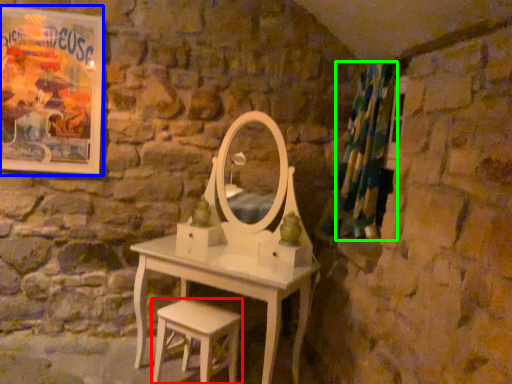
Question: Considering the real-world distances, which object is farthest from stool (highlighted by a red box)? poster page (highlighted by a blue box) or shower curtain (highlighted by a green box)?

Choices:
 (A) poster page
 (B) shower curtain

Answer: (A)